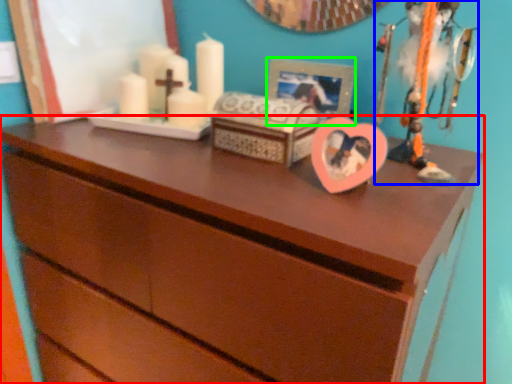
Question: Which object is the closest to the chest of drawers (highlighted by a red box)? Choose among these: toy (highlighted by a blue box) or picture frame (highlighted by a green box).

Choices:
 (A) toy
 (B) picture frame

Answer: (A)